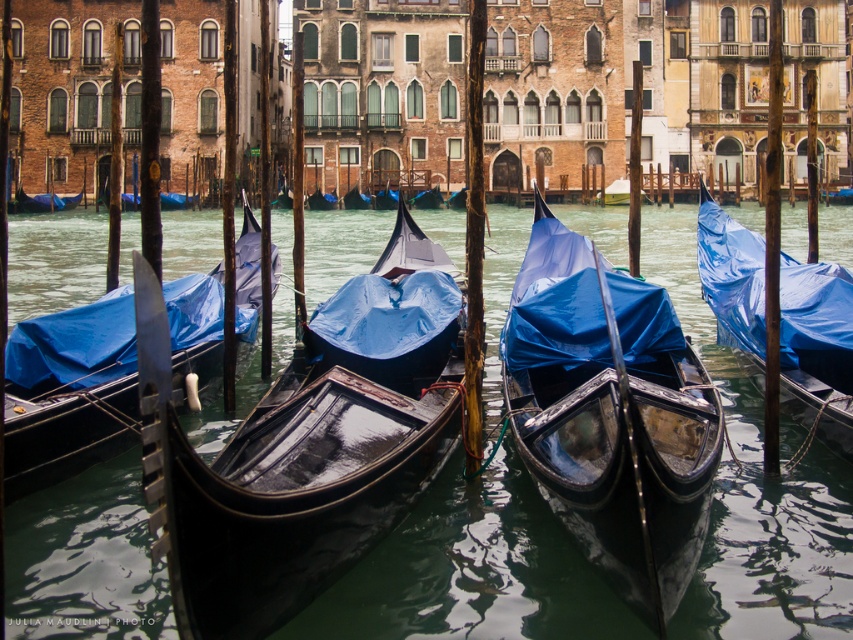
The width and height of the screenshot is (853, 640). What are the coordinates of `shiny black gondola at center` in the screenshot? It's located at (611, 413).

Is point (613, 336) more distant than point (805, 320)?

No, (613, 336) is closer to viewer.

Find the location of a particular element. This screenshot has height=640, width=853. shiny black gondola at center is located at coordinates (611, 413).

Does glossy black gondolas at center have a lesser width compared to shiny black canoe at center?

Incorrect, glossy black gondolas at center's width is not less than shiny black canoe at center's.

Between glossy black gondolas at center and shiny black canoe at center, which one has more height?

glossy black gondolas at center is taller.

Describe the element at coordinates (473, 572) in the screenshot. The height and width of the screenshot is (640, 853). I see `glossy black gondolas at center` at that location.

I want to click on glossy black gondolas at center, so click(473, 572).

Is shiny black canoe at center smaller than blue tarpaulin gondola at center?

No.

Based on the photo, measure the distance between shiny black canoe at center and blue tarpaulin gondola at center.

They are 144.16 feet apart.

Does point (13, 484) come in front of point (762, 288)?

Yes, point (13, 484) is in front of point (762, 288).

Find the location of a particular element. shiny black canoe at center is located at coordinates (73, 397).